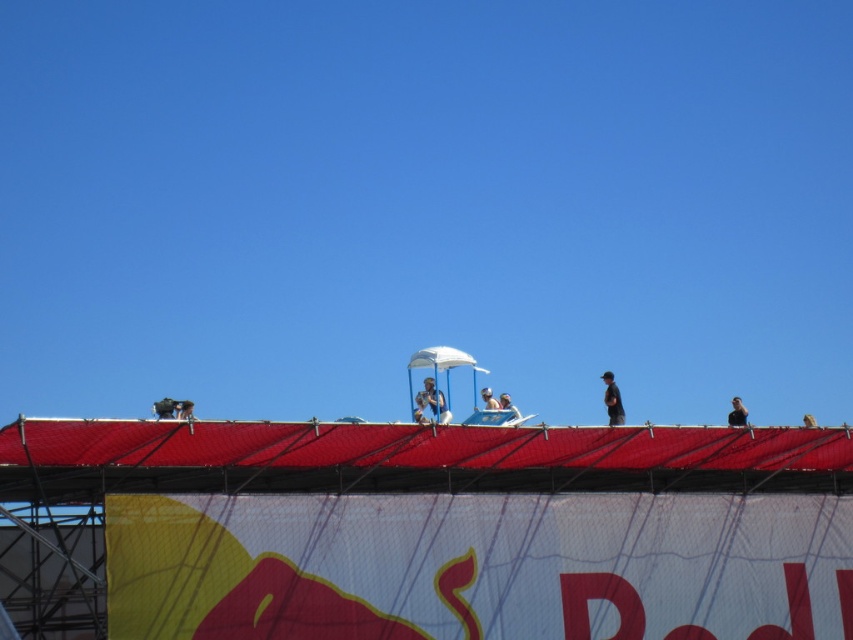
You are an event organizer planning to install a new banner on the structure. You have two options for placement based on the current objects present. The first option is to place it where the black matte person at upper right is standing, and the second is where the white matte helmet at upper center is located. Which location would allow the banner to be more visible to people looking from below?

The black matte person at upper right is taller than the white matte helmet at upper center, so placing the banner where the black matte person at upper right is standing would make it more visible from below because the taller position offers a better vantage point.